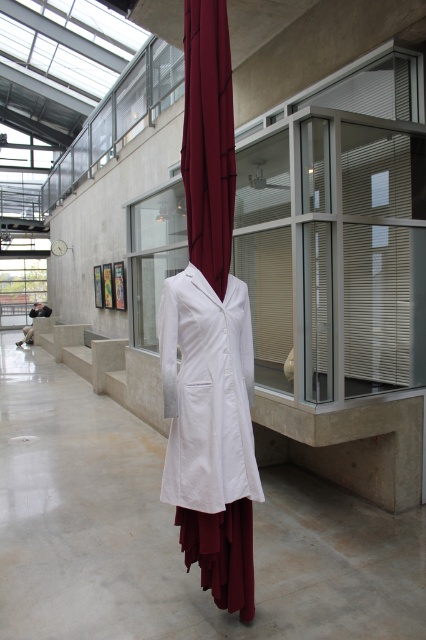
Question: Can you confirm if white smooth coat at center is bigger than burgundy fabric curtain at center?

Choices:
 (A) no
 (B) yes

Answer: (B)

Question: Is white smooth coat at center positioned behind burgundy fabric curtain at center?

Choices:
 (A) yes
 (B) no

Answer: (B)

Question: Is white smooth coat at center to the left of burgundy fabric curtain at center from the viewer's perspective?

Choices:
 (A) no
 (B) yes

Answer: (A)